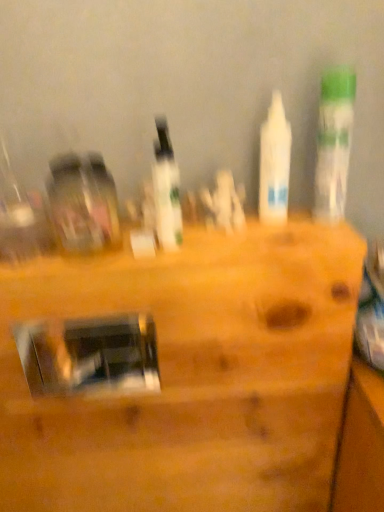
Identify the location of spots to the right of white glossy bottle at center, the first bottle in the left-to-right sequence. (263, 234).